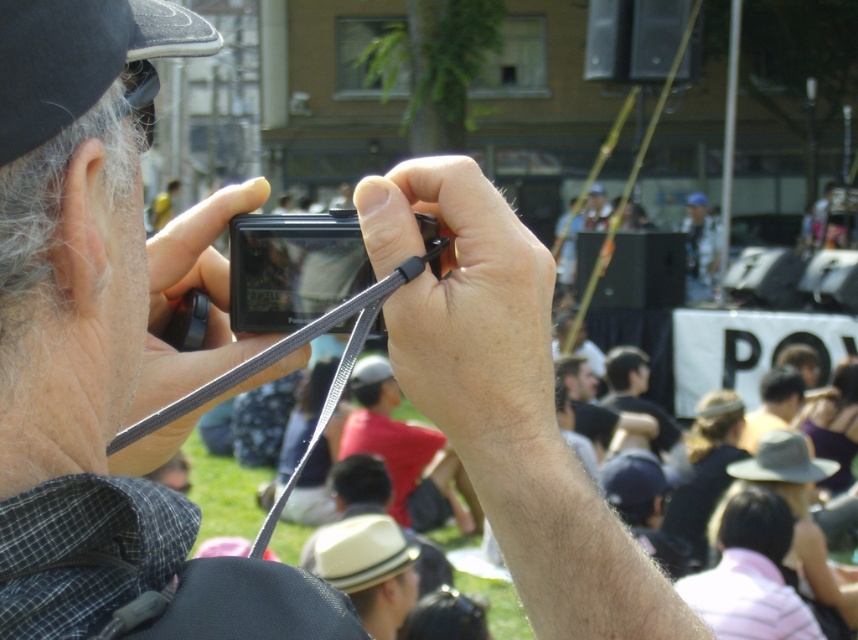
You are a photographer holding a black plastic camera at center. You want to check if the camera is within the safe distance to avoid blurry photos. The recommended minimum distance for this camera model is 3.5 feet. Is your camera too close?

The black plastic camera at center is 3.40 feet from camera, which is slightly closer than the recommended 3.5 feet minimum distance. This could result in blurry photos due to camera shake. Move back a bit to ensure sharpness.

You are standing 1 meter away from the camera being held by the person in the image. If you want to reach the point at coordinates point (333, 273), will you be able to do so without moving closer than your current position?

The point (333, 273) is 1.11 meters away from the viewer. Since you are currently 1 meter away from the camera, you can reach the point without moving closer because it is farther than your current distance.